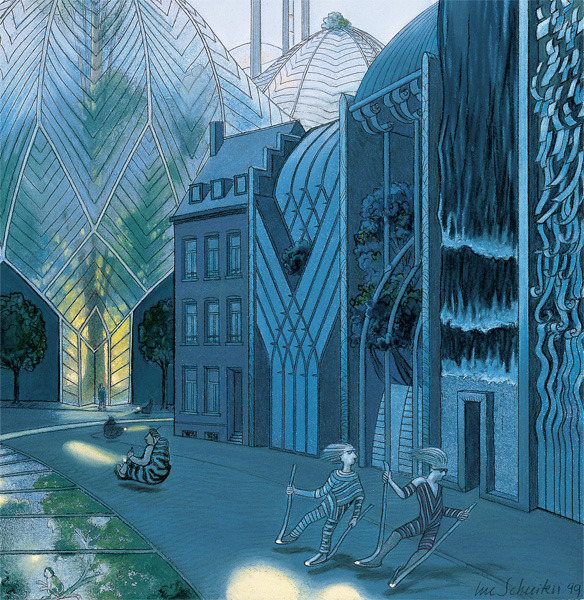
Find the location of a particular element. doors is located at coordinates (93, 365), (236, 410), (471, 435).